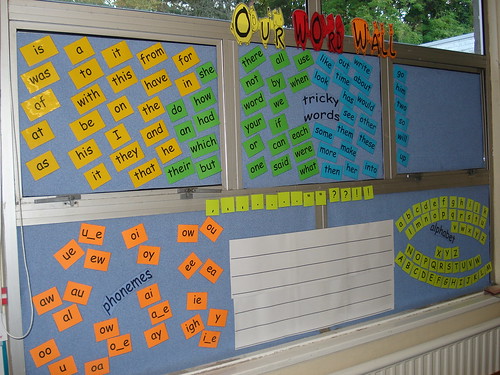
In order to click on wall below window sill in this screenshot , I will do `click(440, 363)`.